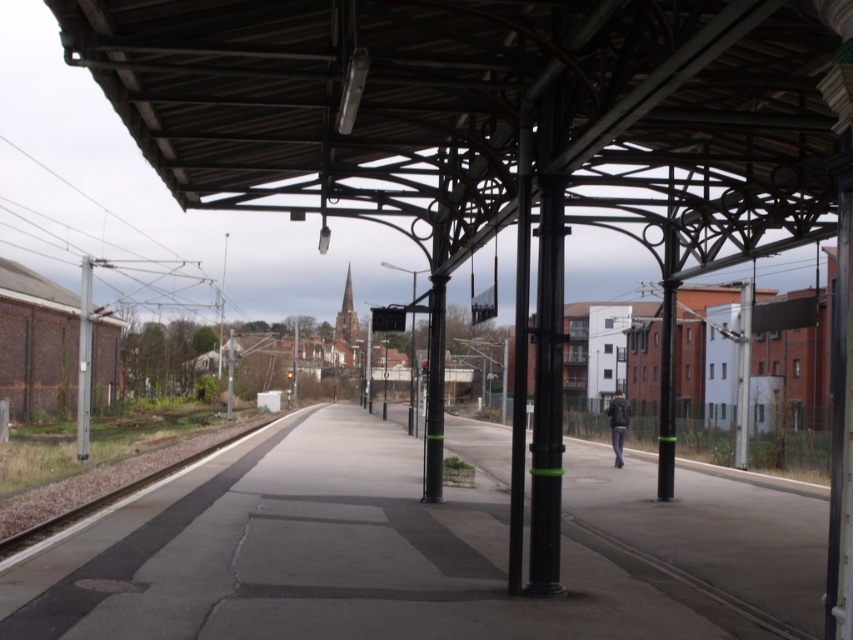
Question: Which point is closer to the camera?

Choices:
 (A) metallic pole at left
 (B) black matte pole at center
 (C) dark gray jacket at right

Answer: (B)

Question: Which object is positioned farthest from the black matte pole at center?

Choices:
 (A) concrete platform at center
 (B) dark gray jacket at right
 (C) black polished pole at center

Answer: (B)

Question: Is concrete platform at center to the right of black polished pole at center from the viewer's perspective?

Choices:
 (A) yes
 (B) no

Answer: (B)

Question: Is black matte pole at center below dark gray jacket at right?

Choices:
 (A) yes
 (B) no

Answer: (B)

Question: Among these objects, which one is farthest from the camera?

Choices:
 (A) concrete platform at center
 (B) black polished pole at center
 (C) black matte pole at center
 (D) metallic pole at left

Answer: (D)

Question: Does concrete platform at center come behind black matte pole at center?

Choices:
 (A) no
 (B) yes

Answer: (A)